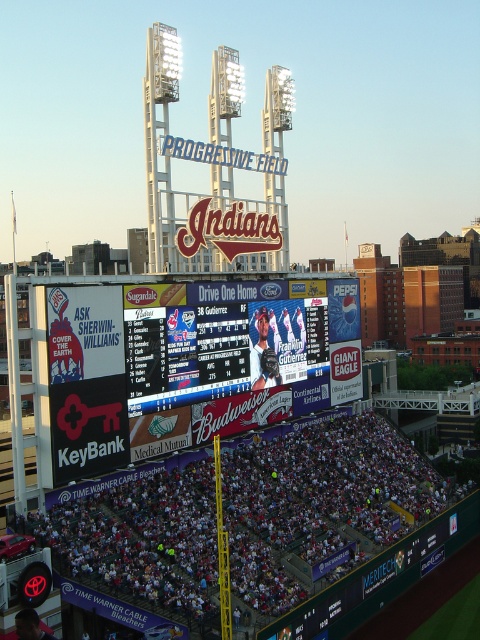
Is white fabric crowd at lower center bigger than white digital scoreboard at center?

Indeed, white fabric crowd at lower center has a larger size compared to white digital scoreboard at center.

Can you confirm if white fabric crowd at lower center is smaller than white digital scoreboard at center?

Actually, white fabric crowd at lower center might be larger than white digital scoreboard at center.

Where is `white fabric crowd at lower center`? white fabric crowd at lower center is located at coordinates (321, 504).